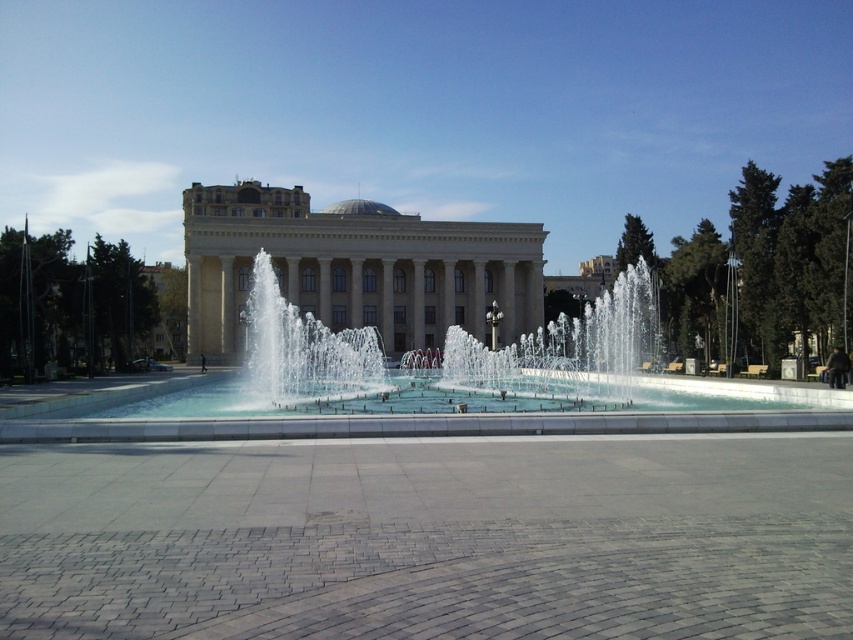
You are standing in front of the grand architectural structure and want to take a photo of the clear water at center. Where should you position yourself to capture the water in the frame?

The clear water at center is located at point (450, 384), so you should position yourself directly in front of the fountain to ensure the water is centered in your photo.